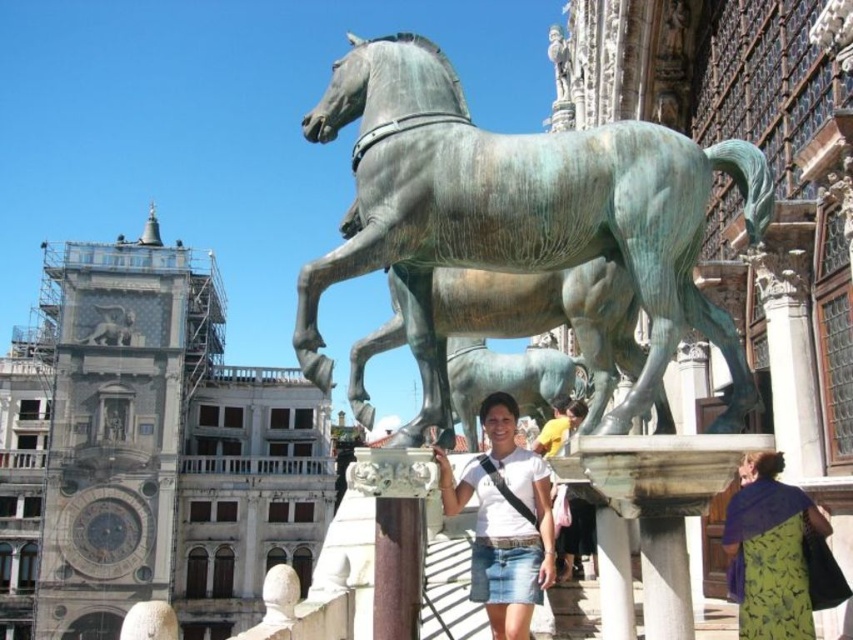
You are a tourist standing in St. Mark Square and want to take a photo of the white fabric shirt at center. Where should you position yourself to capture the shirt in the best possible frame?

The white fabric shirt at center is located at point (503, 520), so you should position yourself directly in front of that coordinate to capture it best.

You are a photographer standing in St. Mark Square and want to take a photo of both the white fabric shirt at center and the green floral dress at lower right. Which one should you focus on first to ensure both are in sharp focus?

The white fabric shirt at center is closer to the viewer than the green floral dress at lower right, so you should focus on the white fabric shirt at center first to ensure both are in sharp focus.